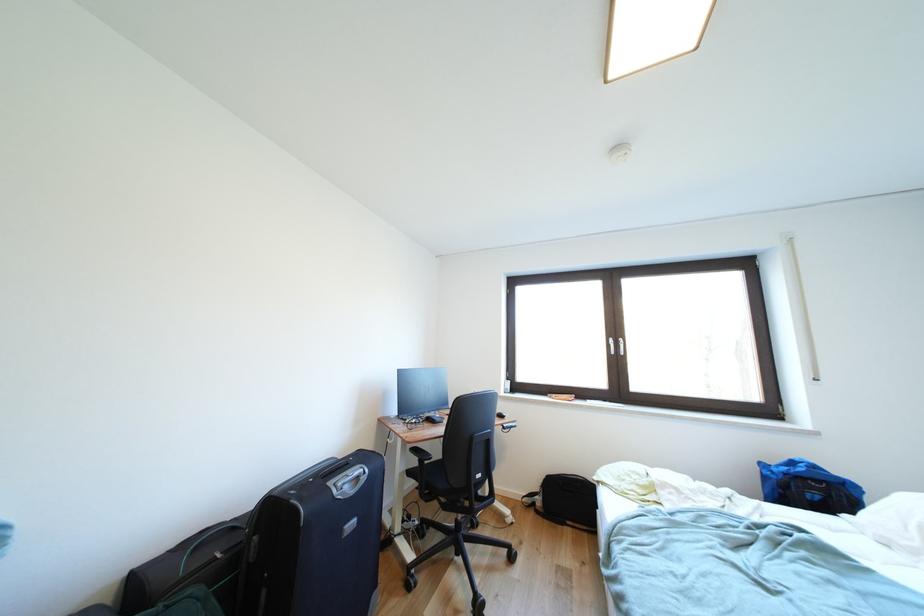
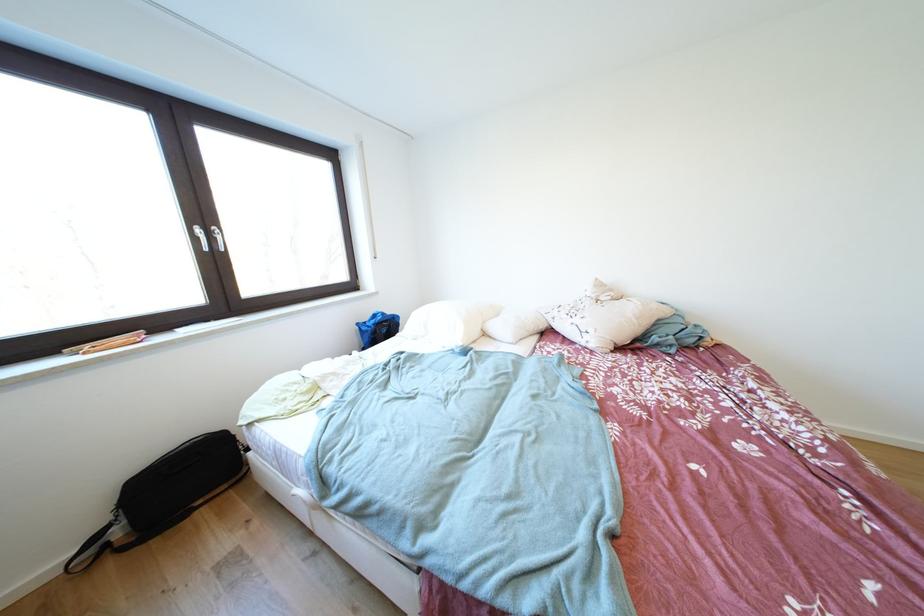
In the second image, find the point that corresponds to (769,468) in the first image.

(367, 329)